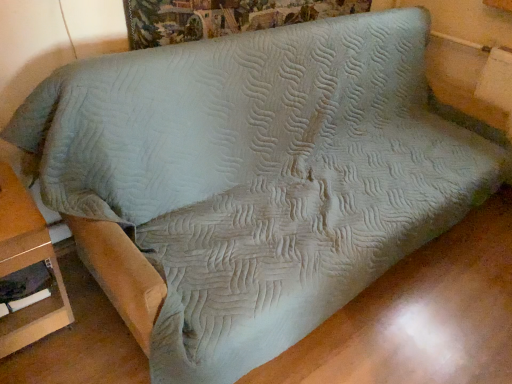
What are the coordinates of `vacant space to the right of wooden drawer at lower left` in the screenshot? It's located at click(x=93, y=334).